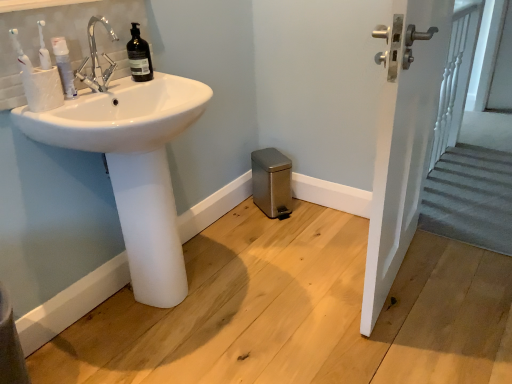
Where is `free space to the right of white glossy door handle at upper right`? free space to the right of white glossy door handle at upper right is located at coordinates (457, 272).